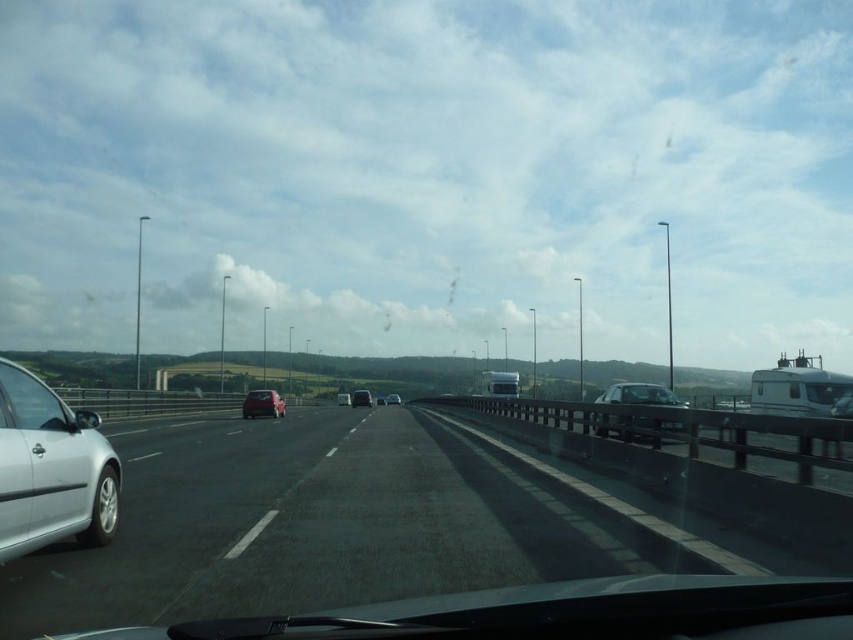
Question: Is shiny silver sedan at center in front of matte red car at center?

Choices:
 (A) yes
 (B) no

Answer: (A)

Question: Is clear glass windshield at left thinner than shiny silver sedan at center?

Choices:
 (A) no
 (B) yes

Answer: (B)

Question: Which object is the closest to the matte red car at center?

Choices:
 (A) metallic silver van at center
 (B) shiny silver sedan at center
 (C) clear glass windshield at left

Answer: (A)

Question: Estimate the real-world distances between objects in this image. Which object is closer to the smooth asphalt highway at center?

Choices:
 (A) matte red car at center
 (B) silver metallic car at left

Answer: (B)

Question: Is shiny silver sedan at center wider than silver metallic sedan at center?

Choices:
 (A) yes
 (B) no

Answer: (B)

Question: Among these points, which one is farthest from the camera?

Choices:
 (A) (670, 396)
 (B) (347, 403)
 (C) (273, 406)
 (D) (19, 401)

Answer: (B)